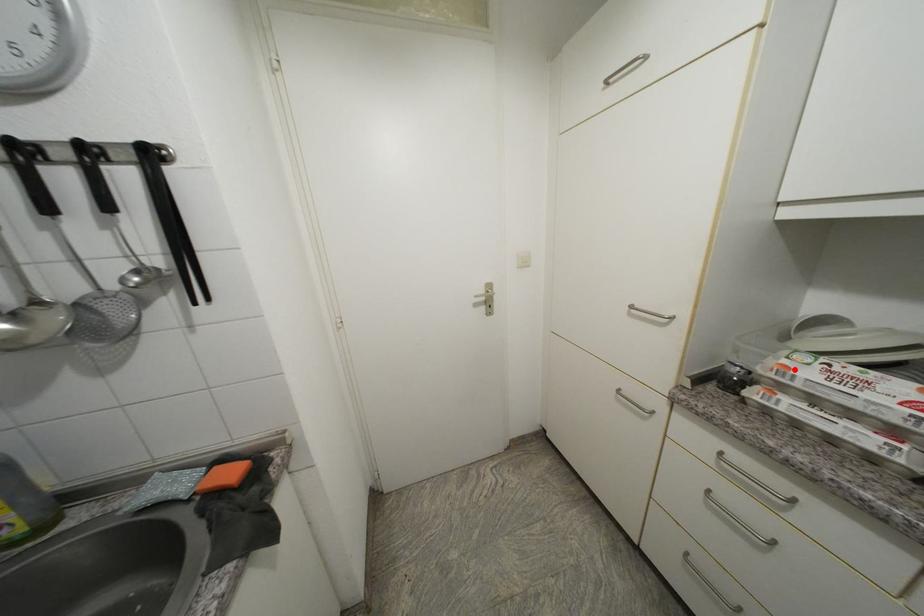
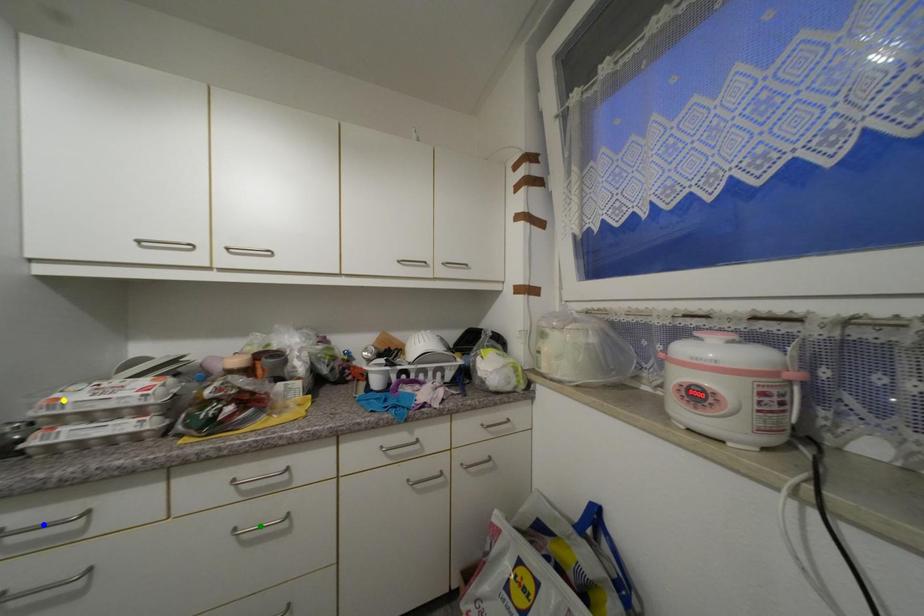
Question: I am providing you with two images of the same scene from different viewpoints. A red point is marked on the first image. You are given multiple points on the second image. Which point in image 2 is actually the same real-world point as the red point in image 1?

Choices:
 (A) blue point
 (B) green point
 (C) yellow point

Answer: (C)